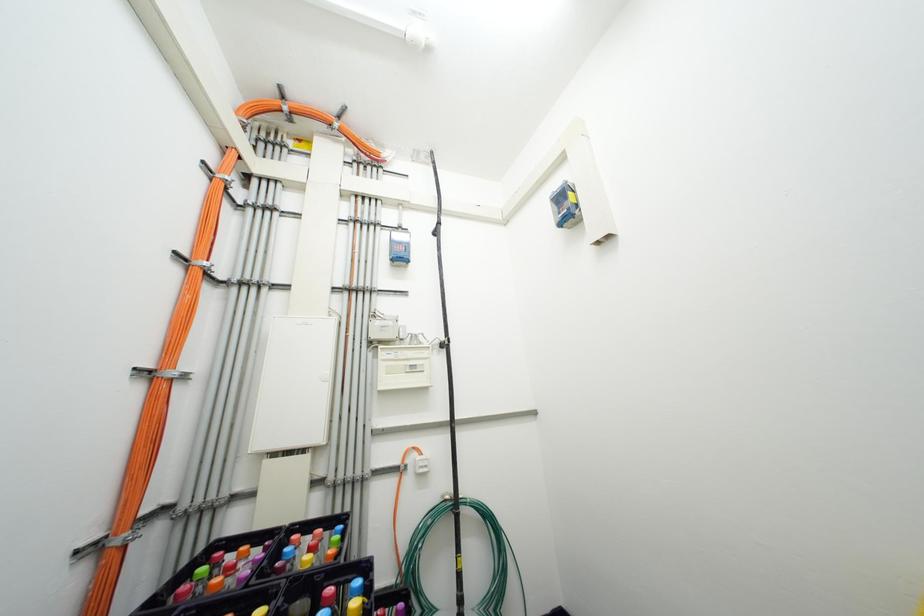
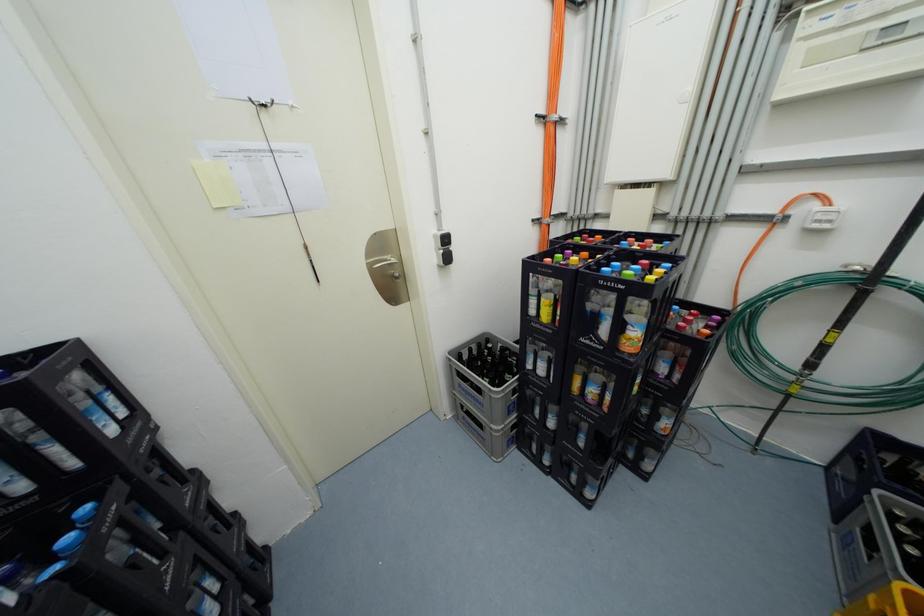
The first image is from the beginning of the video and the second image is from the end. How did the camera likely rotate when shooting the video?

The camera rotated toward left-down.